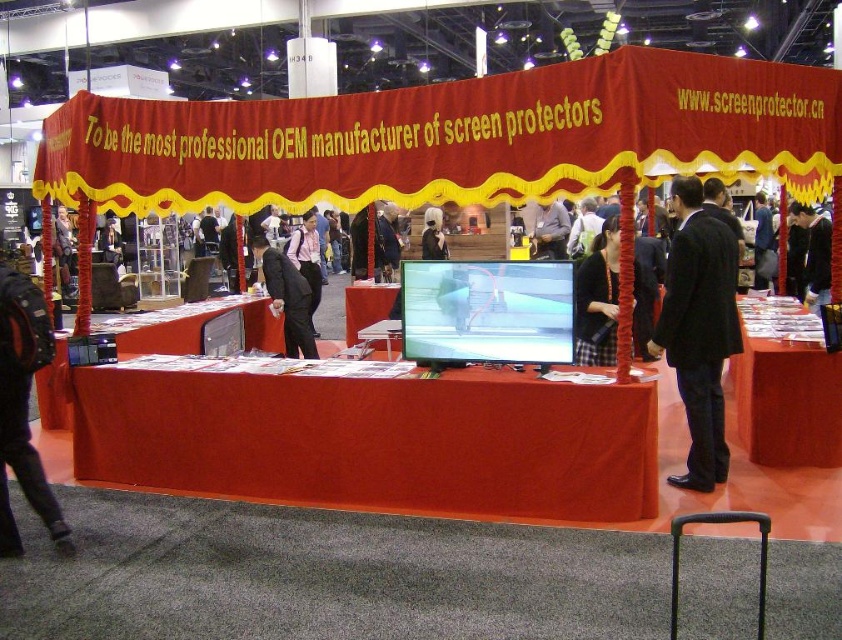
Is point (818, 332) behind point (427, 227)?

No, it is in front of (427, 227).

Who is more forward, (832, 442) or (434, 221)?

Positioned in front is point (832, 442).

Find the location of a particular element. smooth glossy table at center is located at coordinates (786, 388).

Describe the element at coordinates (453, 138) in the screenshot. I see `red/yellow fabric canopy at upper center` at that location.

Can you confirm if red/yellow fabric canopy at upper center is thinner than black suit at center?

No, red/yellow fabric canopy at upper center is not thinner than black suit at center.

Is point (125, 106) positioned behind point (691, 204)?

Yes, it is.

Find the location of a particular element. This screenshot has height=640, width=842. red/yellow fabric canopy at upper center is located at coordinates (453, 138).

Is dark suit at center smaller than smooth plastic table at center?

Actually, dark suit at center might be larger than smooth plastic table at center.

Does dark suit at center lie behind smooth plastic table at center?

No, it is in front of smooth plastic table at center.

Locate an element on the screen. dark suit at center is located at coordinates (286, 298).